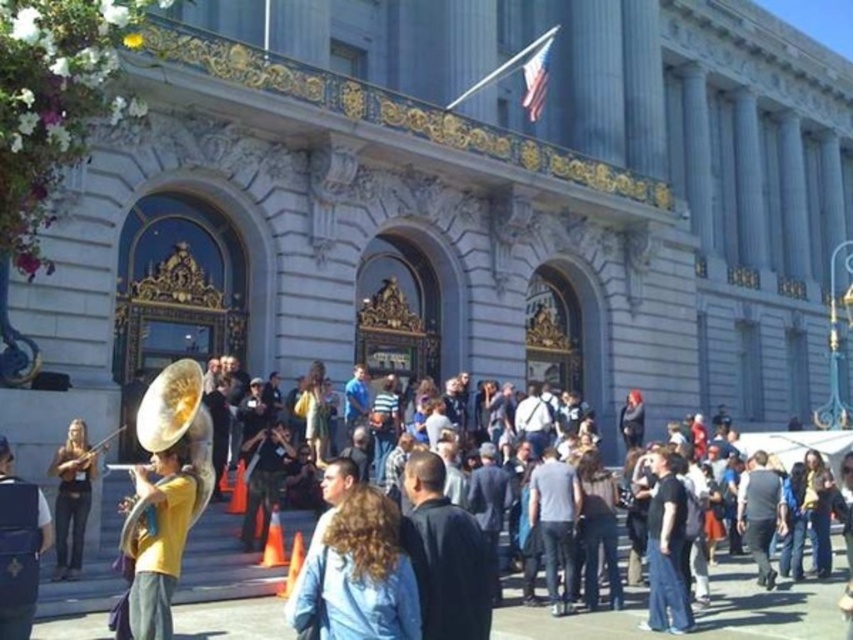
At what (x,y) coordinates should I click in order to perform the action: click on light blue denim jacket at center. Please return your answer as a coordinate pair (x, y). The height and width of the screenshot is (640, 853). Looking at the image, I should click on (358, 573).

Which is more to the left, light blue denim jacket at center or matte brown violin at lower left?

Positioned to the left is matte brown violin at lower left.

Is point (374, 632) behind point (73, 532)?

That is False.

The image size is (853, 640). Identify the location of light blue denim jacket at center. (358, 573).

Is light blue denim jacket at center bigger than gold metallic tuba at left?

Indeed, light blue denim jacket at center has a larger size compared to gold metallic tuba at left.

Can you confirm if light blue denim jacket at center is taller than gold metallic tuba at left?

Incorrect, light blue denim jacket at center's height is not larger of gold metallic tuba at left's.

Find the location of a particular element. light blue denim jacket at center is located at coordinates (358, 573).

At what (x,y) coordinates should I click in order to perform the action: click on light blue denim jacket at center. Please return your answer as a coordinate pair (x, y). Looking at the image, I should click on (358, 573).

Between gold metallic tuba at left and matte brown violin at lower left, which one appears on the left side from the viewer's perspective?

matte brown violin at lower left is more to the left.

Does gold metallic tuba at left have a greater width compared to matte brown violin at lower left?

Incorrect, gold metallic tuba at left's width does not surpass matte brown violin at lower left's.

Between point (12, 474) and point (90, 468), which one is positioned in front?

Positioned in front is point (12, 474).

Find the location of `gold metallic tuba at left`. gold metallic tuba at left is located at coordinates (19, 547).